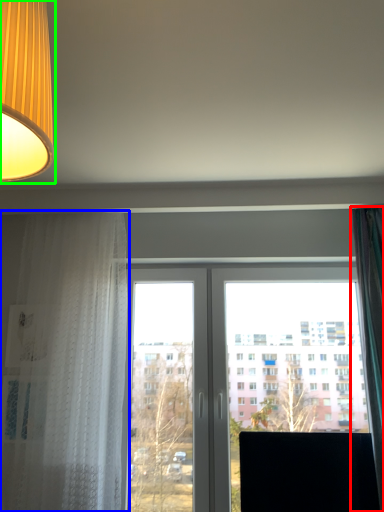
Question: Which object is the closest to the curtain (highlighted by a red box)? Choose among these: curtain (highlighted by a blue box) or lamp (highlighted by a green box).

Choices:
 (A) curtain
 (B) lamp

Answer: (A)